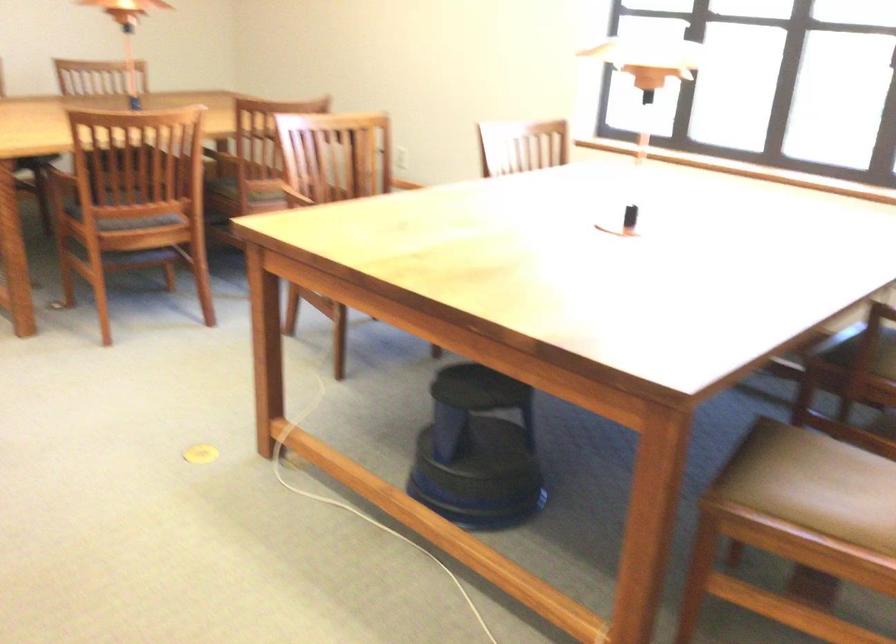
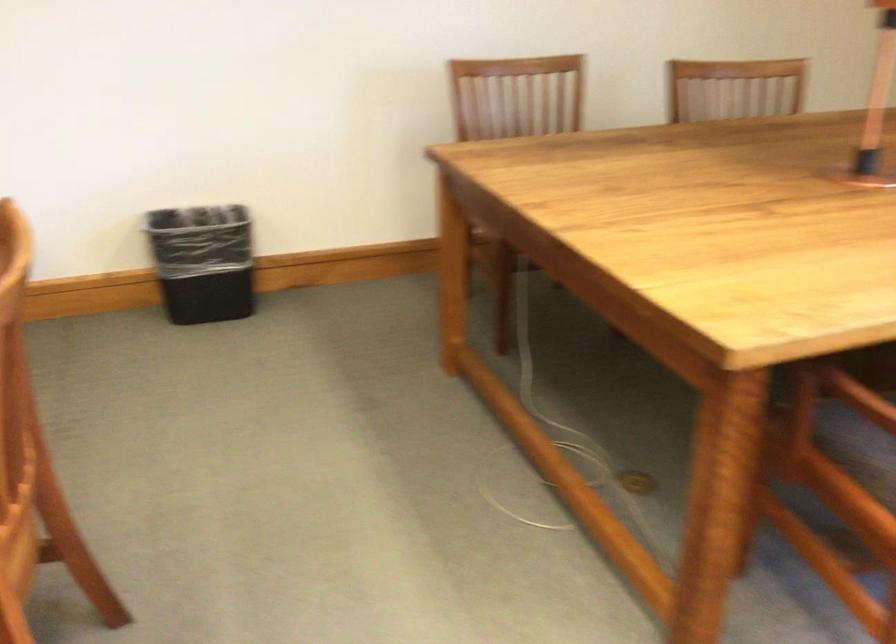
In a continuous first-person perspective shot, in which direction is the camera moving?

The cameraman moved toward left, forward.